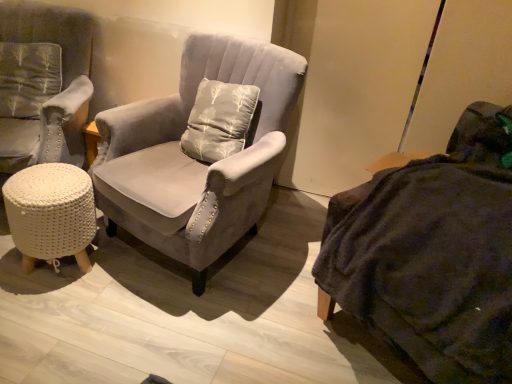
Question: Considering the positions of point (460, 317) and point (98, 187), is point (460, 317) closer or farther from the camera than point (98, 187)?

Choices:
 (A) closer
 (B) farther

Answer: (A)

Question: From the image's perspective, is dark gray fabric couch at right above or below suede gray armchair at center, the 1th chair viewed from the right?

Choices:
 (A) above
 (B) below

Answer: (B)

Question: Estimate the real-world distances between objects in this image. Which object is closer to the velvet gray armchair at left, marked as the second chair in a right-to-left arrangement?

Choices:
 (A) suede gray armchair at center, marked as the 2th chair in a left-to-right arrangement
 (B) dark gray fabric couch at right
 (C) white knitted stool at lower left

Answer: (C)

Question: Estimate the real-world distances between objects in this image. Which object is farther from the suede gray armchair at center, the 1th chair viewed from the right?

Choices:
 (A) dark gray fabric couch at right
 (B) velvet gray armchair at left, marked as the second chair in a right-to-left arrangement
 (C) white knitted stool at lower left

Answer: (A)